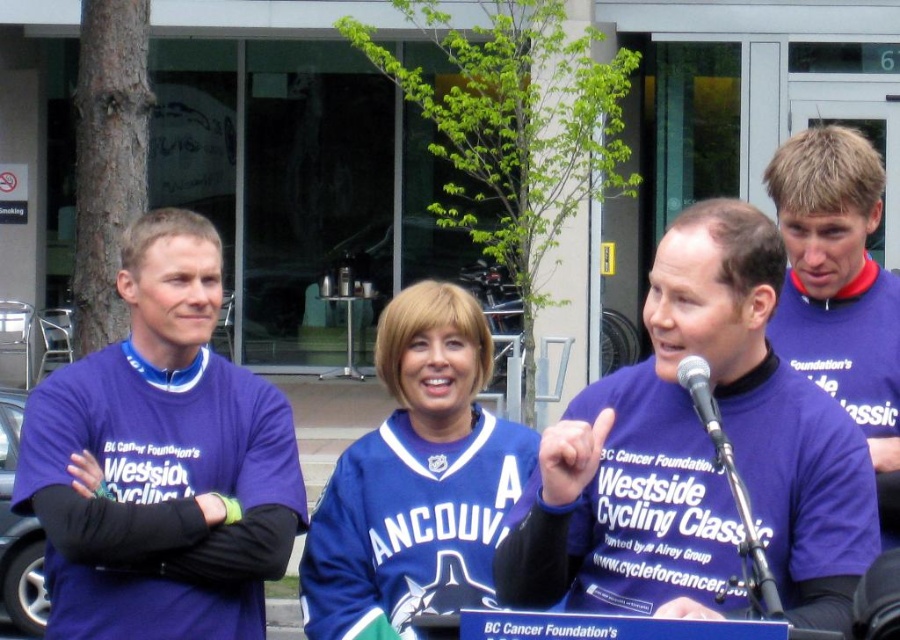
You are a photographer at the BC Cancer Foundation event. You need to position a camera so that both the purple jersey at center and the purple jersey at right are in frame. Which jersey should you focus on first to ensure both are visible?

The purple jersey at center has a lesser height compared to purple jersey at right, so you should focus on the purple jersey at right first to ensure both are visible in the frame.

You are at the BC Cancer Foundation event and see two cyclists wearing purple jersey at left and blue jersey at center. Which cyclist is positioned more to the left side of the group?

The purple jersey at left is positioned more to the left side of the group as it is to the left of the blue jersey at center.